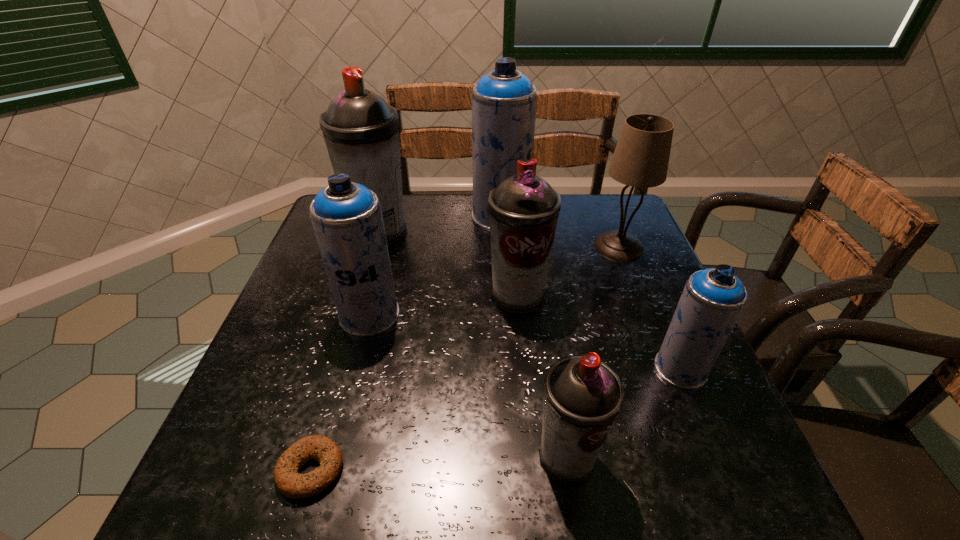
I want to click on vacant area located on the left of the nearest gray aerosol can, so click(x=393, y=457).

Identify the location of vacant space located 0.210m on the right of the shortest object. Image resolution: width=960 pixels, height=540 pixels. (465, 470).

This screenshot has width=960, height=540. I want to click on lampshade situated at the far edge, so click(641, 157).

Where is `aerosol can at the near edge`? The width and height of the screenshot is (960, 540). aerosol can at the near edge is located at coordinates (582, 396).

I want to click on bagel at the near edge, so click(289, 482).

Locate an element on the screen. Image resolution: width=960 pixels, height=540 pixels. bagel that is at the left edge is located at coordinates (289, 482).

Where is `lampshade situated at the right edge`? lampshade situated at the right edge is located at coordinates (641, 157).

Where is `aerosol can that is positioned at the right edge`? The height and width of the screenshot is (540, 960). aerosol can that is positioned at the right edge is located at coordinates (713, 299).

Where is `object that is at the far left corner`? Image resolution: width=960 pixels, height=540 pixels. object that is at the far left corner is located at coordinates (361, 131).

This screenshot has width=960, height=540. Identify the location of object situated at the near left corner. (289, 482).